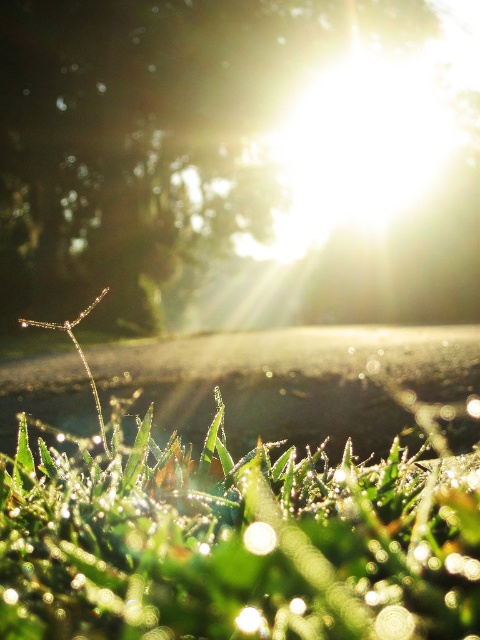
Does green leafy tree at upper center appear on the right side of glistening green grass at lower center?

Correct, you'll find green leafy tree at upper center to the right of glistening green grass at lower center.

Identify the location of green leafy tree at upper center. The width and height of the screenshot is (480, 640). (238, 163).